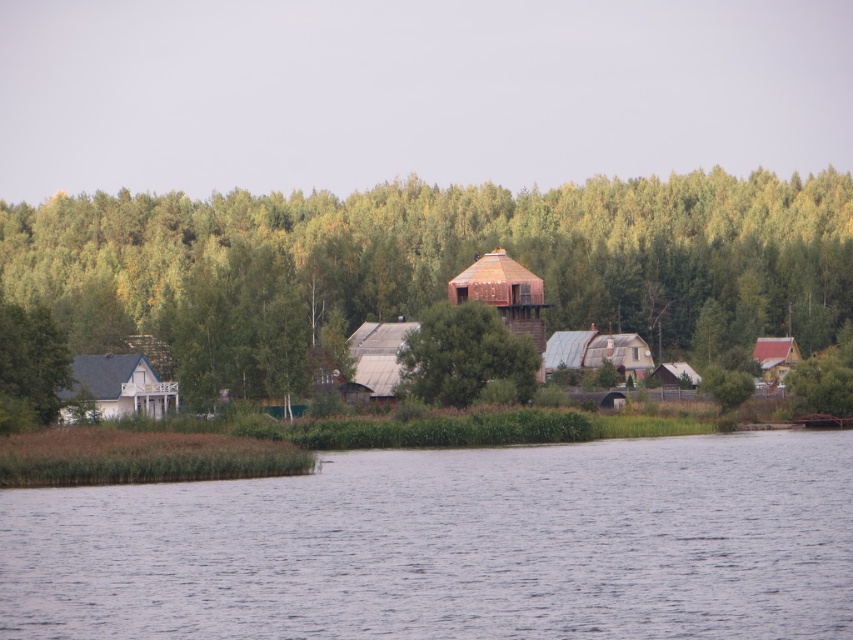
Does point (160, 394) come behind point (389, 333)?

No, (160, 394) is closer to viewer.

Is point (128, 384) more distant than point (349, 353)?

No, (128, 384) is in front of (349, 353).

The width and height of the screenshot is (853, 640). In order to click on white painted wood house at left in this screenshot , I will do `click(115, 388)`.

Between point (3, 326) and point (573, 365), which one is positioned behind?

Positioned behind is point (573, 365).

Locate an element on the screen. The width and height of the screenshot is (853, 640). green leafy tree at left is located at coordinates (28, 365).

Who is more distant from viewer, (6, 333) or (577, 360)?

The point (577, 360) is behind.

Locate an element on the screen. The image size is (853, 640). green leafy tree at left is located at coordinates (28, 365).

Is transparent water at lower center thinner than wooden hut at center?

No.

The width and height of the screenshot is (853, 640). Find the location of `transparent water at lower center`. transparent water at lower center is located at coordinates (453, 545).